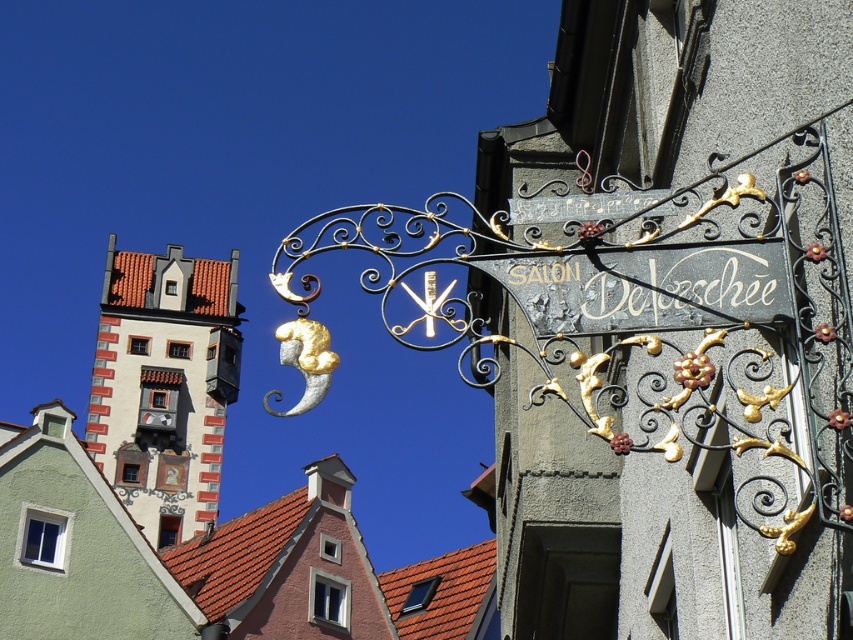
Does polished metal sign at center have a larger size compared to white painted building at upper left?

Actually, polished metal sign at center might be smaller than white painted building at upper left.

Is polished metal sign at center wider than white painted building at upper left?

Incorrect, polished metal sign at center's width does not surpass white painted building at upper left's.

Does point (790, 294) lie behind point (132, 589)?

No, it is not.

Where is `polished metal sign at center`? polished metal sign at center is located at coordinates (677, 324).

Between white painted building at upper left and black wrought iron sign at upper center, which one appears on the left side from the viewer's perspective?

Positioned to the left is white painted building at upper left.

Between point (434, 621) and point (570, 300), which one is positioned behind?

The point (434, 621) is behind.

In order to click on white painted building at upper left in this screenshot , I will do `click(196, 500)`.

Image resolution: width=853 pixels, height=640 pixels. I want to click on white painted building at upper left, so click(x=196, y=500).

Does polished metal sign at center have a lesser height compared to black wrought iron sign at upper center?

Incorrect, polished metal sign at center's height does not fall short of black wrought iron sign at upper center's.

Is point (683, 445) positioned before point (633, 292)?

No, it is behind (633, 292).

The image size is (853, 640). I want to click on polished metal sign at center, so click(677, 324).